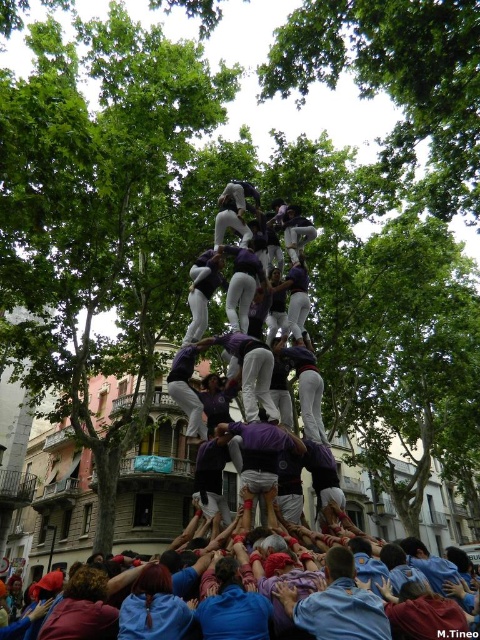
You are a photographer trying to capture the human tower in the scene. You notice two points marked in the image. Which point, point [421,45] or point [354,570], is closer to your camera lens?

Point [421,45] is further to the camera than point [354,570], so point [354,570] is closer to the camera lens.

You are standing in front of the human tower and notice two groups in blue. The first group is the blue cotton shirt at lower center, and the second is the blue fabric crowd at lower center. From your perspective, which group is positioned more to the right?

The blue cotton shirt at lower center is positioned more to the right compared to the blue fabric crowd at lower center.

Based on the scene, can you determine if the green leafy tree at upper center has a wider spread than the blue fabric crowd at lower center?

The green leafy tree at upper center might be wider than blue fabric crowd at lower center.